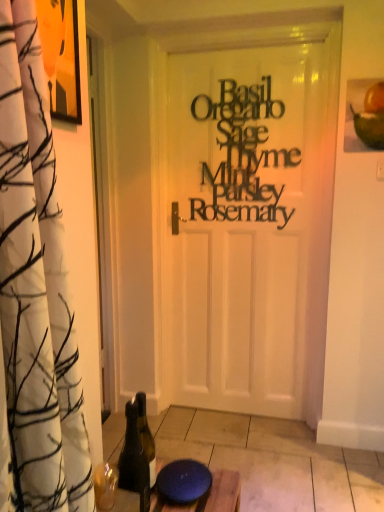
Question: Is green glass bottle at lower left to the left or to the right of black paper sign at center in the image?

Choices:
 (A) right
 (B) left

Answer: (B)

Question: Is green glass bottle at lower left in front of or behind black paper sign at center in the image?

Choices:
 (A) behind
 (B) front

Answer: (B)

Question: Would you say green glass bottle at lower left is inside or outside black paper sign at center?

Choices:
 (A) inside
 (B) outside

Answer: (B)

Question: From the image's perspective, relative to green glass bottle at lower left, is black paper sign at center above or below?

Choices:
 (A) below
 (B) above

Answer: (B)

Question: Based on their sizes in the image, would you say black paper sign at center is bigger or smaller than green glass bottle at lower left?

Choices:
 (A) small
 (B) big

Answer: (B)

Question: From a real-world perspective, relative to green glass bottle at lower left, is black paper sign at center vertically above or below?

Choices:
 (A) above
 (B) below

Answer: (A)

Question: Considering their positions, is black paper sign at center located in front of or behind green glass bottle at lower left?

Choices:
 (A) front
 (B) behind

Answer: (B)